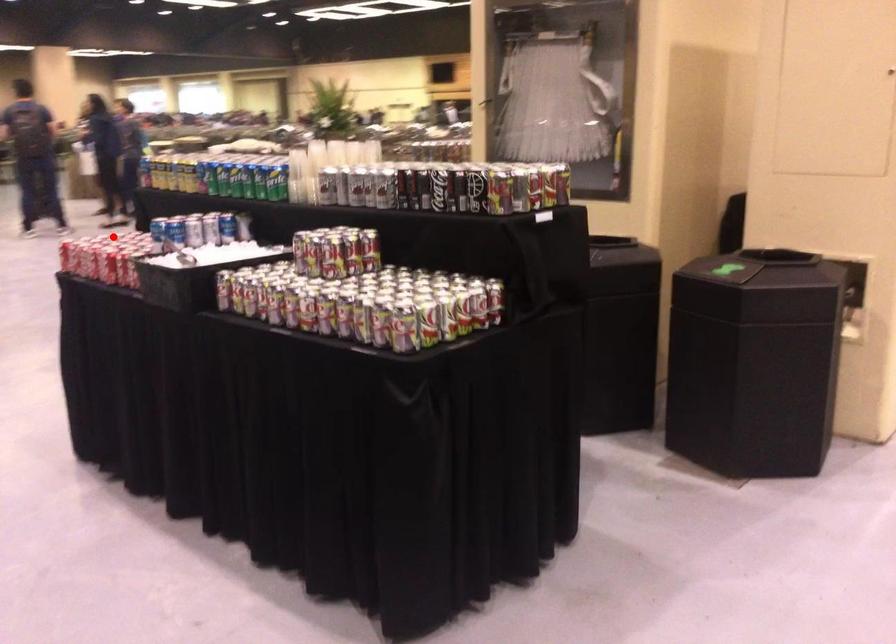
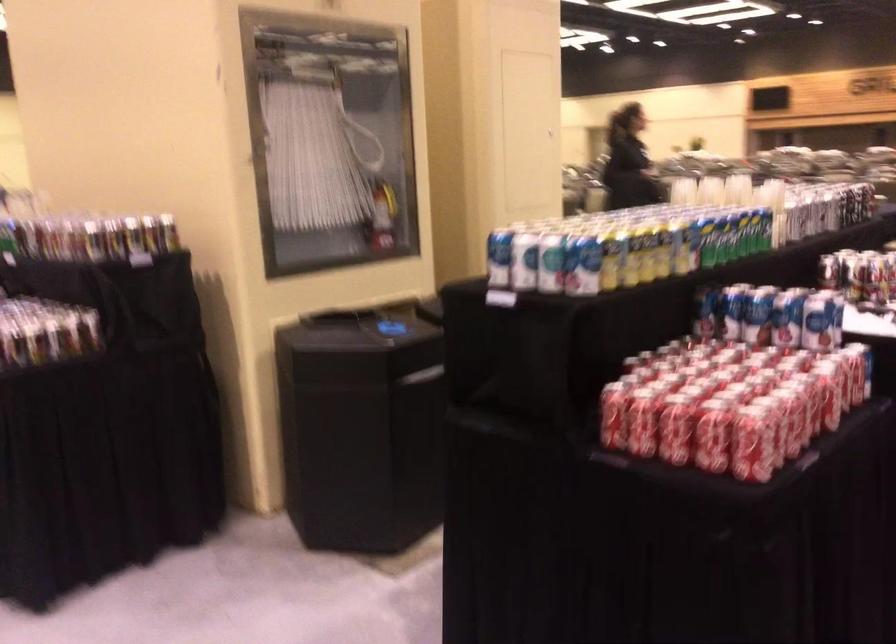
Question: I am providing you with two images of the same scene from different viewpoints. Image1 has a red point marked. In image2, the corresponding 3D location appears at what relative position? Reply with the corresponding letter.

Choices:
 (A) Closer
 (B) Farther

Answer: (A)